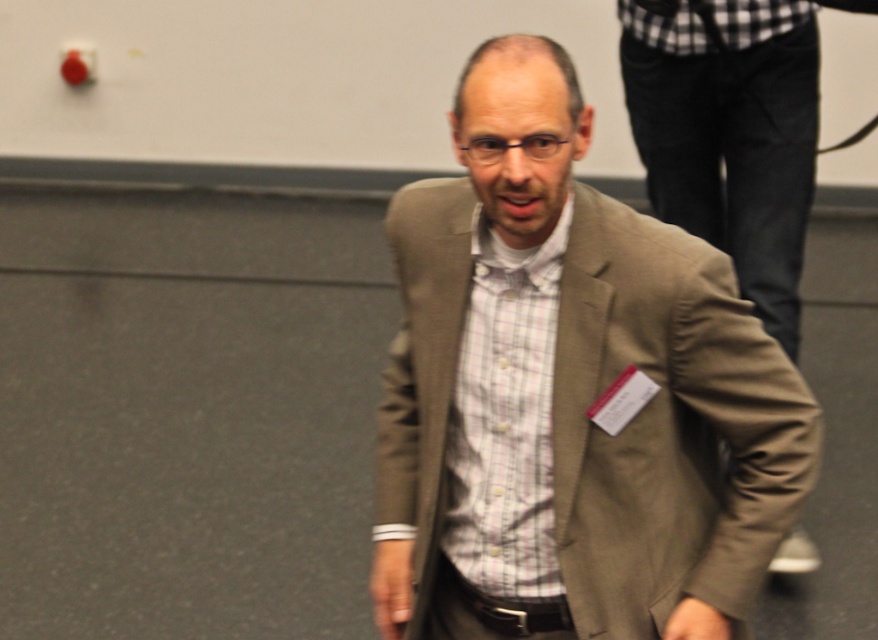
Question: Can you confirm if matte brown blazer at center is wider than matte beige blazer at center?

Choices:
 (A) yes
 (B) no

Answer: (A)

Question: Does matte brown blazer at center appear on the left side of matte beige blazer at center?

Choices:
 (A) yes
 (B) no

Answer: (A)

Question: Which of the following is the farthest from the observer?

Choices:
 (A) (x=722, y=349)
 (B) (x=790, y=557)

Answer: (B)

Question: Which object appears closest to the camera in this image?

Choices:
 (A) matte beige blazer at center
 (B) matte brown blazer at center

Answer: (B)

Question: Is matte brown blazer at center positioned behind matte beige blazer at center?

Choices:
 (A) no
 (B) yes

Answer: (A)